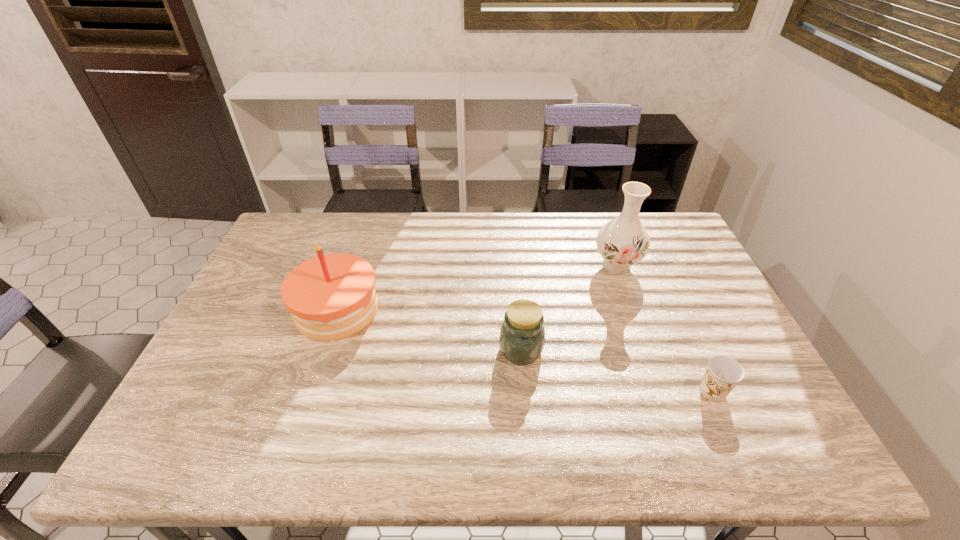
Find the location of a particular element. This screenshot has height=540, width=960. object that is at the far edge is located at coordinates (622, 242).

Identify the location of object located at the right edge. (723, 373).

Locate an element on the screen. This screenshot has height=540, width=960. vacant space at the far edge is located at coordinates (592, 232).

Find the location of a particular element. vacant area at the near edge of the desktop is located at coordinates (379, 441).

Find the location of a particular element. vacant region at the left edge of the desktop is located at coordinates (259, 330).

In the image, there is a desktop. What are the coordinates of `free space at the far left corner` in the screenshot? It's located at (294, 241).

Identify the location of vacant region between the jar and the leftmost object. (429, 329).

Locate an element on the screen. free space between the leftmost object and the third object from right to left is located at coordinates (429, 329).

In order to click on free spot between the rightmost object and the second object from left to right in this screenshot , I will do `click(616, 370)`.

You are a GUI agent. You are given a task and a screenshot of the screen. Output one action in this format:
    pyautogui.click(x=<x>, y=<y>)
    Task: Click on the empty location between the leftmost object and the third object from right to left
    The width and height of the screenshot is (960, 540).
    Given the screenshot: What is the action you would take?
    pyautogui.click(x=429, y=329)